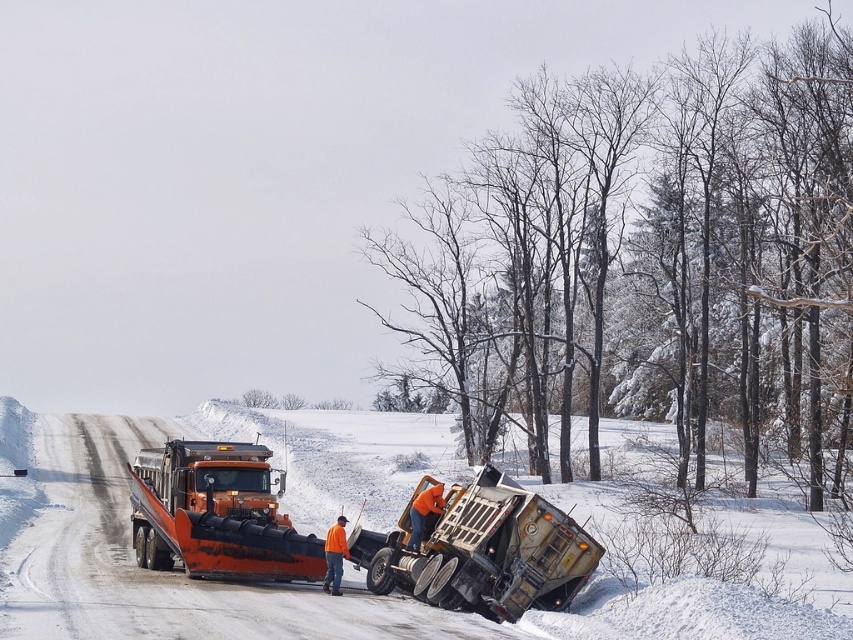
You are a rescue worker who needs to reach the overturned dump truck. You are currently at the point marked by coordinates point (300, 531). What is the nearest object to your current location?

The nearest object to your current location at point (300, 531) is the white powdery snow at center, as the coordinates indicate that the point is located there.

You are a snow removal worker assessing the overturned dump truck scene. You notice two snowplows in the image. Which one is the smaller orange metallic snowplow at lower center compared to the orange matte snowplow at left?

The orange metallic snowplow at lower center is smaller than the orange matte snowplow at left.

You are a snow removal worker assessing the overturned dump truck scene. You see the orange metallic snowplow at lower center and the orange matte snowplow at left. Which snowplow is nearer to you?

The orange metallic snowplow at lower center is closer to the viewer than the orange matte snowplow at left.